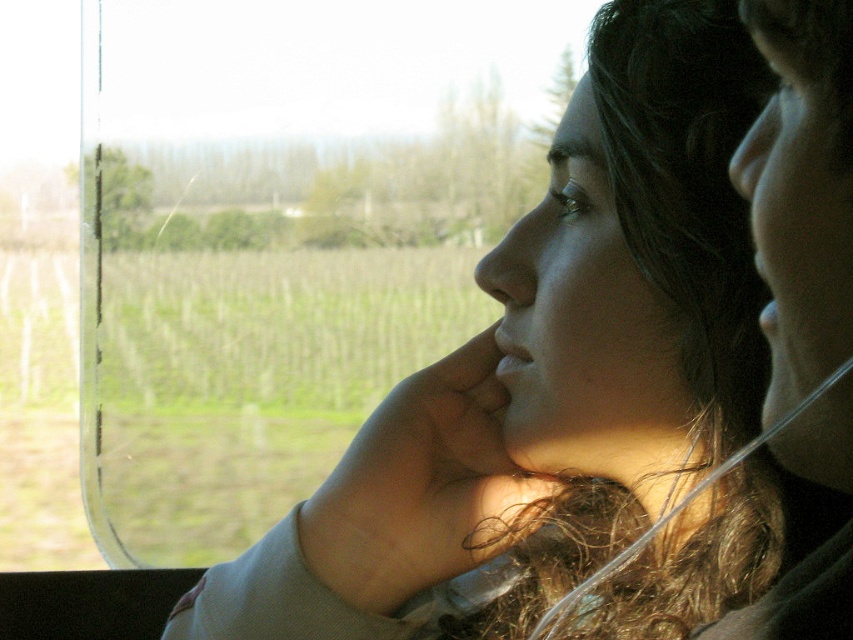
Which is above, smooth skin face at right or matte skin nose at upper right?

matte skin nose at upper right is above.

Does point (824, 406) come farther from viewer compared to point (784, 99)?

No, it is in front of (784, 99).

You are a GUI agent. You are given a task and a screenshot of the screen. Output one action in this format:
    pyautogui.click(x=<x>, y=<y>)
    Task: Click on the smooth skin face at right
    This screenshot has width=853, height=640.
    Given the screenshot: What is the action you would take?
    pyautogui.click(x=801, y=189)

Is smooth skin face at right further to the viewer compared to matte skin nose at center?

No, smooth skin face at right is closer to the viewer.

Locate an element on the screen. smooth skin face at right is located at coordinates (801, 189).

Does matte gray sweater at center have a lesser width compared to matte skin nose at upper right?

In fact, matte gray sweater at center might be wider than matte skin nose at upper right.

Is point (744, 525) farther from camera compared to point (782, 145)?

Yes.

You are a GUI agent. You are given a task and a screenshot of the screen. Output one action in this format:
    pyautogui.click(x=<x>, y=<y>)
    Task: Click on the matte gray sweater at center
    This screenshot has height=640, width=853.
    Given the screenshot: What is the action you would take?
    pyautogui.click(x=548, y=376)